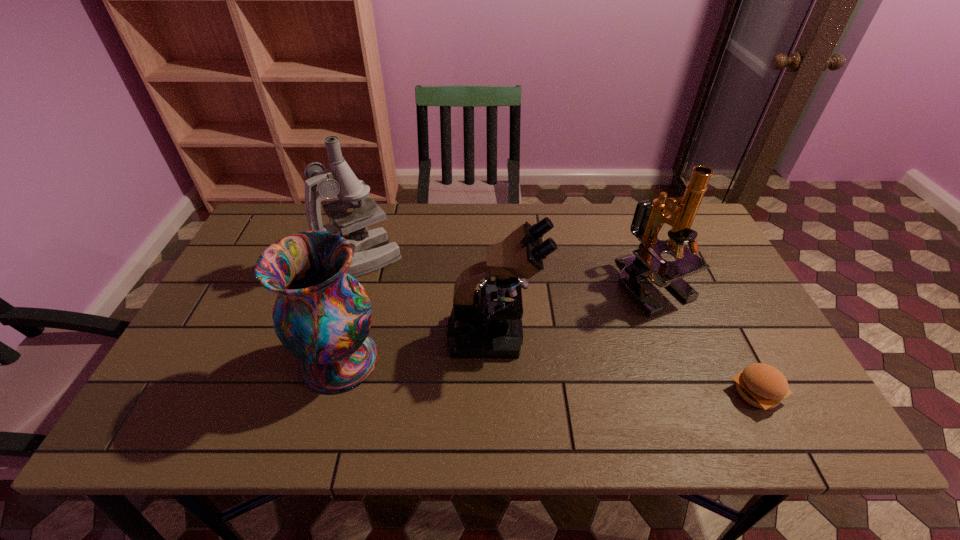
Find the location of a particular element. The height and width of the screenshot is (540, 960). vacant space that satisfies the following two spatial constraints: 1. on the front side of the vase; 2. on the left side of the hamburger is located at coordinates (332, 393).

Image resolution: width=960 pixels, height=540 pixels. In order to click on free location that satisfies the following two spatial constraints: 1. on the front side of the shortest object; 2. on the right side of the third object from left to right in this screenshot , I will do `click(496, 393)`.